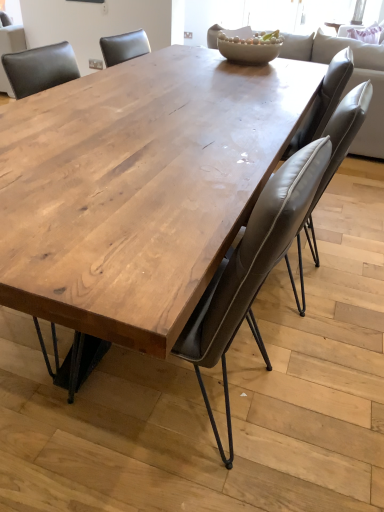
Question: From the image's perspective, does light gray leather couch at upper center appear lower than leather at center, the 1th chair when ordered from right to left?

Choices:
 (A) no
 (B) yes

Answer: (A)

Question: Is light gray leather couch at upper center shorter than leather at center, the 1th chair when ordered from right to left?

Choices:
 (A) no
 (B) yes

Answer: (A)

Question: From a real-world perspective, is light gray leather couch at upper center physically below leather at center, acting as the 2th chair starting from the left?

Choices:
 (A) yes
 (B) no

Answer: (B)

Question: From the image's perspective, would you say light gray leather couch at upper center is positioned over leather at center, acting as the 2th chair starting from the left?

Choices:
 (A) no
 (B) yes

Answer: (B)

Question: Is light gray leather couch at upper center directly adjacent to leather at center, the 1th chair when ordered from right to left?

Choices:
 (A) yes
 (B) no

Answer: (B)

Question: Is light gray leather couch at upper center located outside leather at center, the 1th chair when ordered from right to left?

Choices:
 (A) no
 (B) yes

Answer: (B)

Question: Is leather at center, the 1th chair when ordered from right to left, turned away from matte wood table at center, acting as the first chair starting from the left?

Choices:
 (A) no
 (B) yes

Answer: (A)

Question: Is the position of leather at center, the 1th chair when ordered from right to left, more distant than that of matte wood table at center, acting as the first chair starting from the left?

Choices:
 (A) yes
 (B) no

Answer: (A)

Question: From a real-world perspective, is leather at center, acting as the 2th chair starting from the left, positioned under matte wood table at center, which ranks as the second chair in right-to-left order, based on gravity?

Choices:
 (A) yes
 (B) no

Answer: (B)

Question: Considering the relative sizes of leather at center, acting as the 2th chair starting from the left, and matte wood table at center, acting as the first chair starting from the left, in the image provided, is leather at center, acting as the 2th chair starting from the left, smaller than matte wood table at center, acting as the first chair starting from the left,?

Choices:
 (A) no
 (B) yes

Answer: (A)

Question: Is leather at center, acting as the 2th chair starting from the left, at the left side of matte wood table at center, acting as the first chair starting from the left?

Choices:
 (A) yes
 (B) no

Answer: (B)

Question: Does leather at center, the 1th chair when ordered from right to left, have a lesser width compared to matte wood table at center, acting as the first chair starting from the left?

Choices:
 (A) no
 (B) yes

Answer: (A)

Question: Can we say matte wood table at center, which ranks as the second chair in right-to-left order, lies outside leather at center, acting as the 2th chair starting from the left?

Choices:
 (A) no
 (B) yes

Answer: (B)